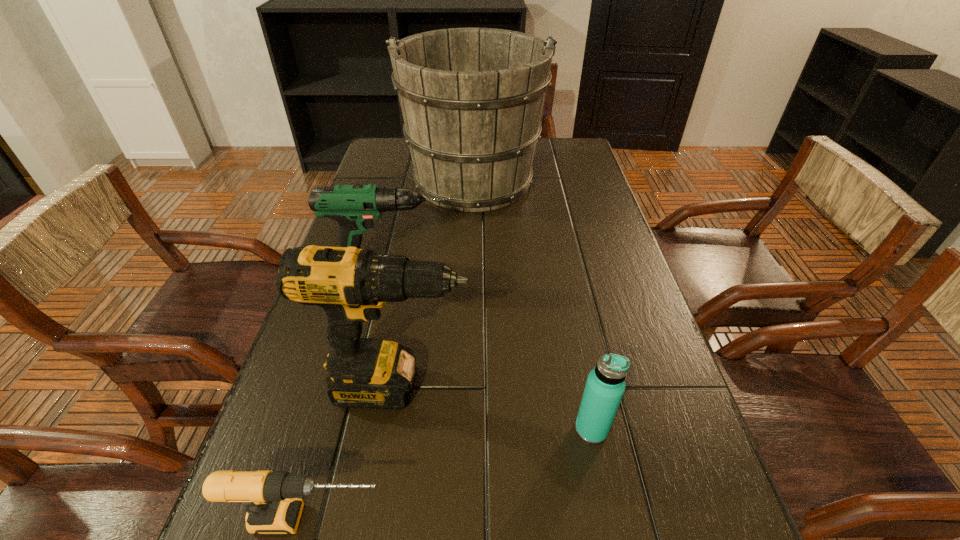
The height and width of the screenshot is (540, 960). In order to click on free space that satisfies the following two spatial constraints: 1. at the tip of the second farthest drill; 2. on the right side of the second nearest object in this screenshot , I will do `click(391, 429)`.